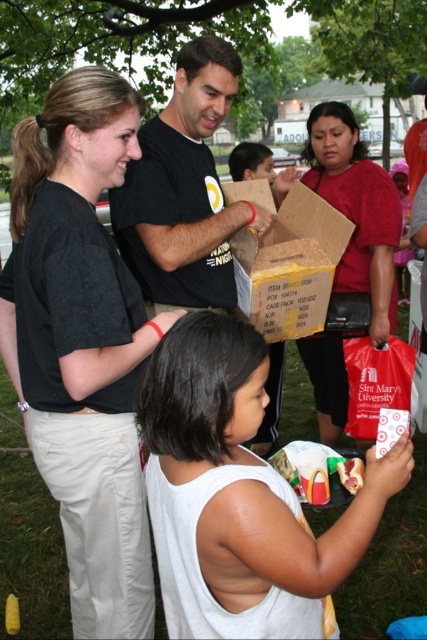
Question: Considering the relative positions of matte black shirt at center and matte red bag at center in the image provided, where is matte black shirt at center located with respect to matte red bag at center?

Choices:
 (A) below
 (B) above

Answer: (B)

Question: Is black matte shirt at upper left bigger than matte red bag at center?

Choices:
 (A) no
 (B) yes

Answer: (A)

Question: Based on their relative distances, which object is nearer to the brown cardboard box at center?

Choices:
 (A) black matte shirt at upper left
 (B) smooth plastic bag at lower center

Answer: (A)

Question: Which point appears closest to the camera in this image?

Choices:
 (A) (350, 488)
 (B) (204, 449)
 (C) (78, 77)
 (D) (287, 225)

Answer: (B)

Question: Which object appears farthest from the camera in this image?

Choices:
 (A) brown cardboard box at center
 (B) smooth plastic bag at lower center
 (C) matte black shirt at center

Answer: (A)

Question: Considering the relative positions of black matte shirt at upper left and smooth plastic bag at lower center in the image provided, where is black matte shirt at upper left located with respect to smooth plastic bag at lower center?

Choices:
 (A) below
 (B) above

Answer: (B)